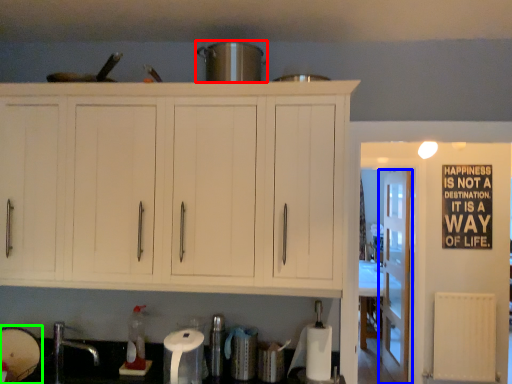
Question: Which is nearer to the appliance (highlighted by a red box)? door (highlighted by a blue box) or appliance (highlighted by a green box).

Choices:
 (A) door
 (B) appliance

Answer: (B)